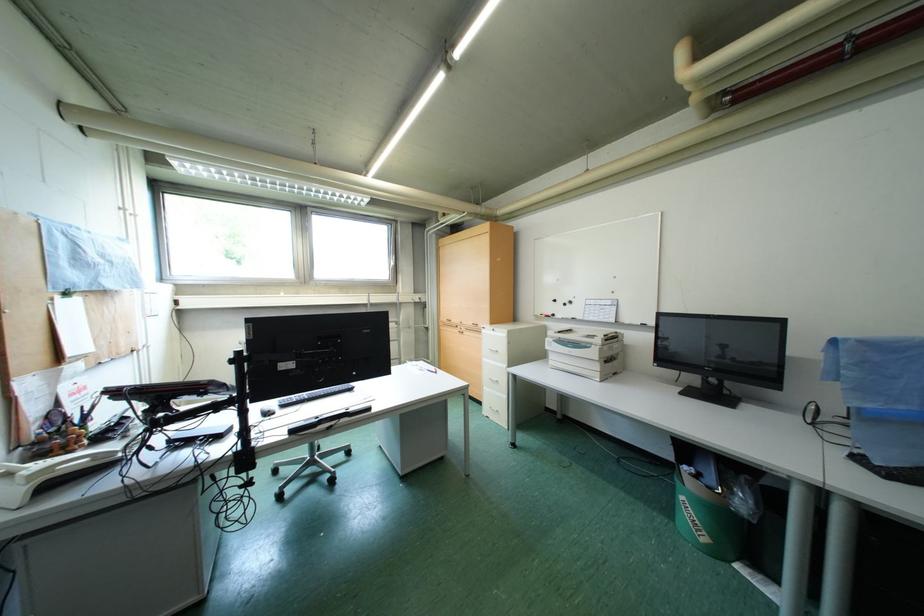
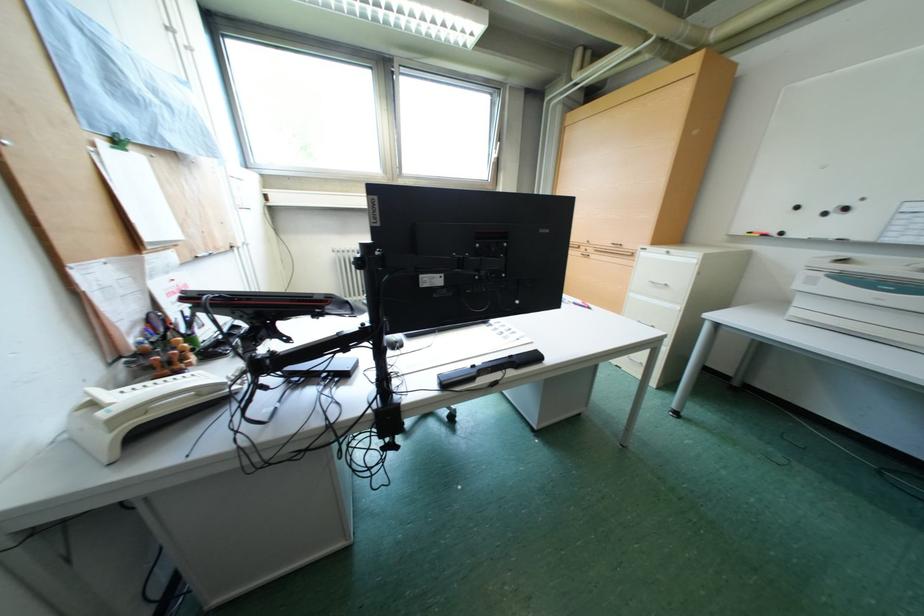
In a continuous first-person perspective shot, in which direction is the camera moving?

The cameraman walked toward left, forward.